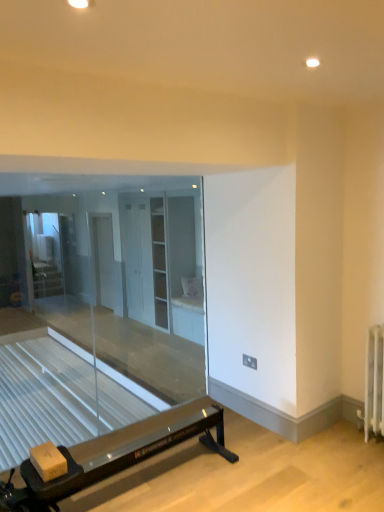
Question: From a real-world perspective, is transparent glass door at left above or below white glossy cabinet at center, which is the 2th screen door in left-to-right order?

Choices:
 (A) below
 (B) above

Answer: (B)

Question: Is transparent glass door at left in front of or behind white glossy cabinet at center, marked as the 1th screen door in a front-to-back arrangement, in the image?

Choices:
 (A) front
 (B) behind

Answer: (B)

Question: Which is farther from the black rubber exercise machine at lower left?

Choices:
 (A) transparent glass door at left
 (B) white glossy cabinet at center, which is the 2th screen door in left-to-right order
 (C) white glossy screen door at center, the 1th screen door in the back-to-front sequence

Answer: (A)

Question: Which object is positioned closest to the white glossy screen door at center, placed as the 1th screen door when sorted from left to right?

Choices:
 (A) transparent glass door at left
 (B) white glossy cabinet at center, placed as the first screen door when sorted from right to left
 (C) black rubber exercise machine at lower left

Answer: (A)